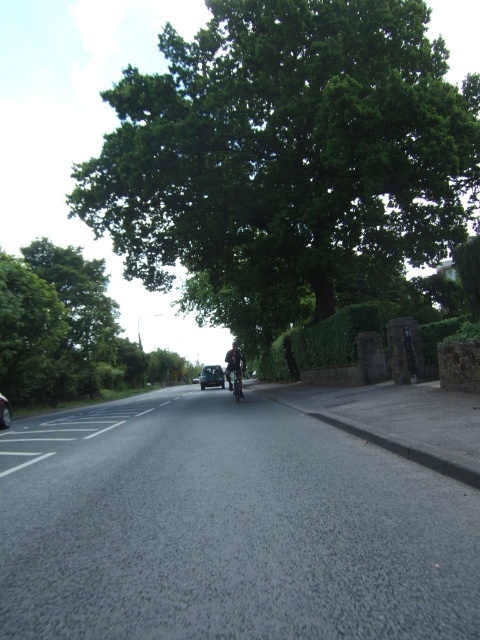
You are a photographer trying to capture a photo of the green leafy tree at center and the green leafy tree at upper center. Which tree should you focus on if you want to capture the wider tree in your shot?

The green leafy tree at center is wider than the green leafy tree at upper center, so you should focus on the green leafy tree at center to capture the wider tree in your shot.

You are standing at the point marked as point (285, 157) on the road. You want to walk directly to the green leafy tree at center. Is there any object in the way between you and the tree?

The green leafy tree at center is located at point (285, 157), so you are already at the same location as the tree. There are no objects in the way because you are already there.

In the scene shown: You are a delivery robot navigating the street. You need to move from your current position to the gate on the right side of the road. There are two points marked on the road. The first point is at coordinate point(203, 371) and the second point is at coordinate point(226, 369). Which point should you avoid to stay on the correct path towards the gate?

You should avoid point(226, 369) because point(203, 371) is in front of it, meaning the correct path towards the gate is closer to point(203, 371).